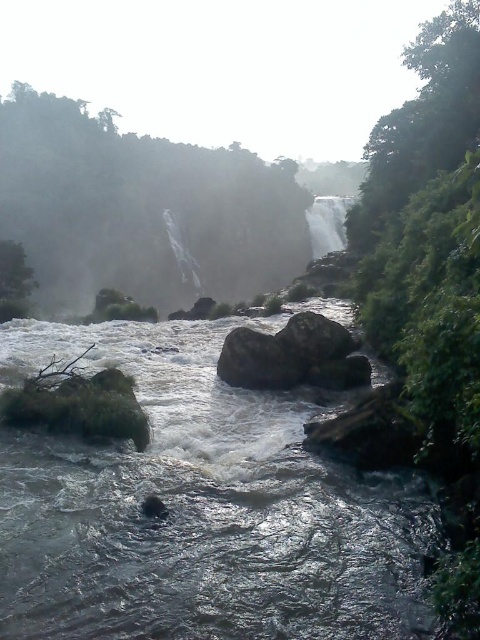
You are a hiker trying to cross the river at the center. You see the gray rough rock at center and the smooth rock at center. Which rock is taller and would provide a better stepping stone?

The gray rough rock at center is much taller than the smooth rock at center, so it would provide a better stepping stone.

You are a hiker trying to cross the river at the dark gray stone stream at center and the gray rough rock at center. Which location would allow you to step onto a surface closer to you?

The dark gray stone stream at center is closer to the viewer than the gray rough rock at center, so stepping onto the dark gray stone stream at center would be closer to you.